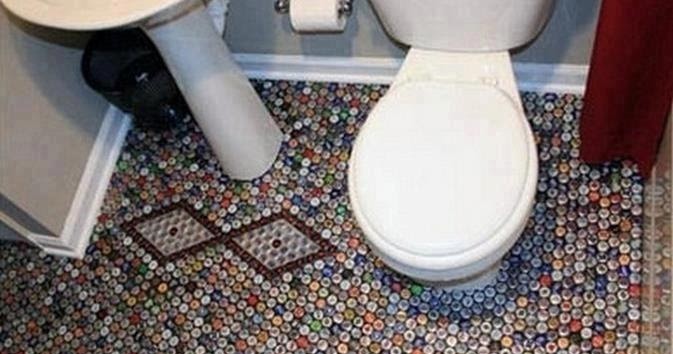
The image size is (673, 354). Find the location of `toilet paper`. toilet paper is located at coordinates (324, 18).